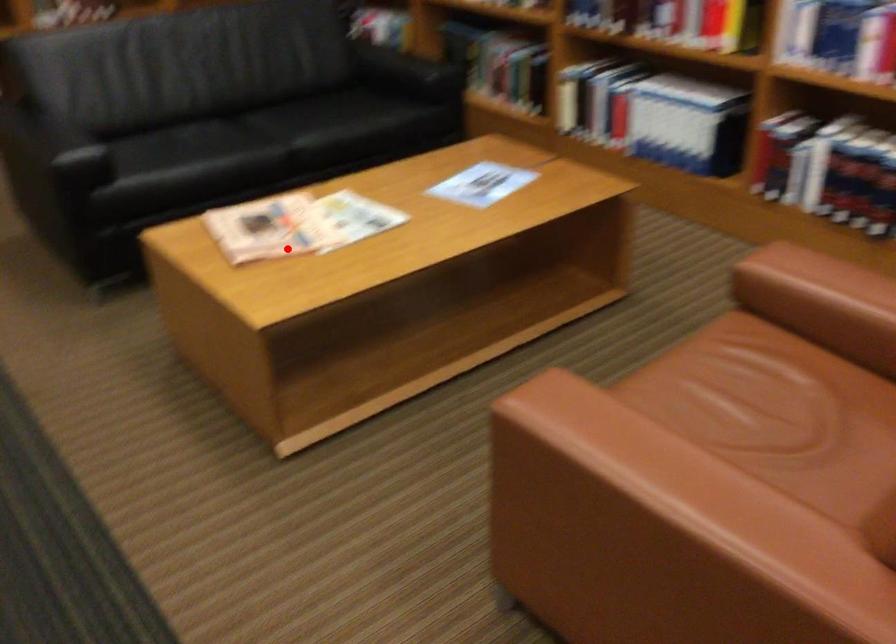
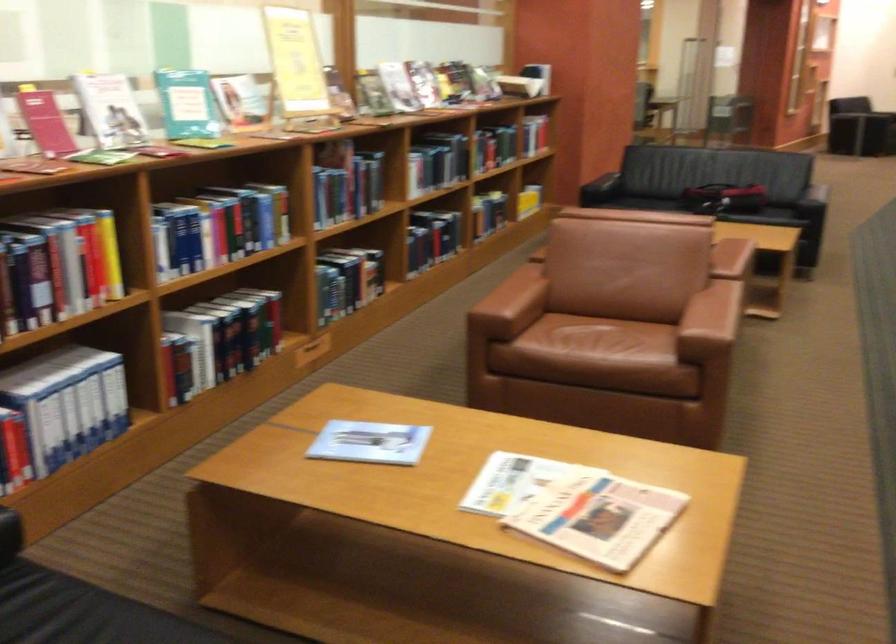
Find the pixel in the second image that matches the highlighted location in the first image.

(574, 507)